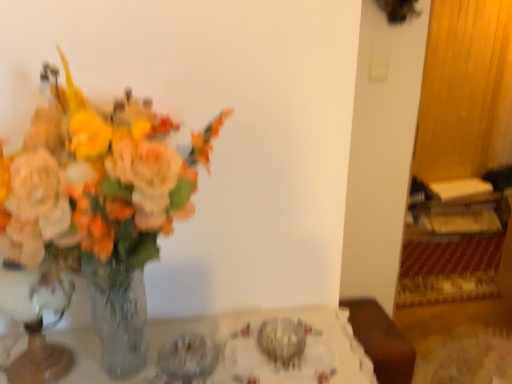
Describe the element at coordinates (97, 180) in the screenshot. This screenshot has width=512, height=384. I see `translucent glass vase at left` at that location.

Describe the element at coordinates (239, 349) in the screenshot. The height and width of the screenshot is (384, 512). I see `clear glass vase at left` at that location.

Where is `clear glass vase at left`? The width and height of the screenshot is (512, 384). clear glass vase at left is located at coordinates (37, 321).

Looking at this image, from the image's perspective, relative to translucent glass vase at left, is clear glass vase at left above or below?

Clearly, from the image's perspective, clear glass vase at left is below translucent glass vase at left.

Consider the image. Considering their positions, is clear glass vase at left located in front of or behind translucent glass vase at left?

clear glass vase at left is behind translucent glass vase at left.

From a real-world perspective, is clear glass vase at left physically located above or below translucent glass vase at left?

Clearly, from a real-world perspective, clear glass vase at left is below translucent glass vase at left.

Does point (63, 280) come in front of point (152, 346)?

Yes, it is in front of point (152, 346).

Considering the sizes of objects clear glass vase at left and clear glass vase at left in the image provided, who is shorter, clear glass vase at left or clear glass vase at left?

Standing shorter between the two is clear glass vase at left.

From a real-world perspective, is clear glass vase at left below clear glass vase at left?

No, from a real-world perspective, clear glass vase at left is not below clear glass vase at left.

Is clear glass vase at left at the back of clear glass vase at left?

That's not correct — clear glass vase at left is not looking away from clear glass vase at left.

Does clear glass vase at left have a greater height compared to clear glass vase at left?

No.

Considering the sizes of objects clear glass vase at left and clear glass vase at left in the image provided, who is bigger, clear glass vase at left or clear glass vase at left?

clear glass vase at left is bigger.

Which is more to the left, clear glass vase at left or clear glass vase at left?

Positioned to the left is clear glass vase at left.

Between point (315, 347) and point (38, 339), which one is positioned behind?

The point (315, 347) is more distant.

Considering the relative sizes of clear glass vase at left and translucent glass vase at left in the image provided, is clear glass vase at left bigger than translucent glass vase at left?

Actually, clear glass vase at left might be smaller than translucent glass vase at left.

Who is more distant, clear glass vase at left or translucent glass vase at left?

clear glass vase at left is more distant.

Does clear glass vase at left have a greater width compared to translucent glass vase at left?

No.

Could you tell me if clear glass vase at left is facing translucent glass vase at left?

No, clear glass vase at left is not aimed at translucent glass vase at left.

From a real-world perspective, who is located higher, translucent glass vase at left or clear glass vase at left?

translucent glass vase at left is physically above.

Between translucent glass vase at left and clear glass vase at left, which one appears on the right side from the viewer's perspective?

Positioned to the right is clear glass vase at left.

Can you see translucent glass vase at left touching clear glass vase at left?

They are not placed beside each other.

Based on their sizes in the image, would you say translucent glass vase at left is bigger or smaller than clear glass vase at left?

In the image, translucent glass vase at left appears to be larger than clear glass vase at left.

Considering their positions, is translucent glass vase at left located in front of or behind clear glass vase at left?

Clearly, translucent glass vase at left is in front of clear glass vase at left.

Is translucent glass vase at left facing towards clear glass vase at left?

No.

Is there a large distance between translucent glass vase at left and clear glass vase at left?

No, translucent glass vase at left is not far away from clear glass vase at left.

Which is more to the left, translucent glass vase at left or clear glass vase at left?

Positioned to the left is clear glass vase at left.

This screenshot has width=512, height=384. Find the location of `vase beneath the translucent glass vase at left (from a real-world perspective)`. vase beneath the translucent glass vase at left (from a real-world perspective) is located at coordinates (37, 321).

In order to click on table behind the clear glass vase at left in this screenshot , I will do `click(239, 349)`.

Estimate the real-world distances between objects in this image. Which object is closer to clear glass vase at left, translucent glass vase at left or clear glass vase at left?

clear glass vase at left is positioned closer to the anchor clear glass vase at left.

Which object lies further to the anchor point translucent glass vase at left, clear glass vase at left or clear glass vase at left?

Based on the image, clear glass vase at left appears to be further to translucent glass vase at left.

Based on their spatial positions, is clear glass vase at left or clear glass vase at left closer to translucent glass vase at left?

The object closer to translucent glass vase at left is clear glass vase at left.

Looking at the image, which one is located further to clear glass vase at left, translucent glass vase at left or clear glass vase at left?

translucent glass vase at left is positioned further to the anchor clear glass vase at left.

From the image, which object appears to be farther from clear glass vase at left, clear glass vase at left or translucent glass vase at left?

translucent glass vase at left is further to clear glass vase at left.

From the picture: Considering their positions, is clear glass vase at left positioned closer to clear glass vase at left than translucent glass vase at left?

Based on the image, clear glass vase at left appears to be nearer to clear glass vase at left.

At what (x,y) coordinates should I click in order to perform the action: click on vase between translucent glass vase at left and clear glass vase at left from top to bottom. Please return your answer as a coordinate pair (x, y). Looking at the image, I should click on (37, 321).